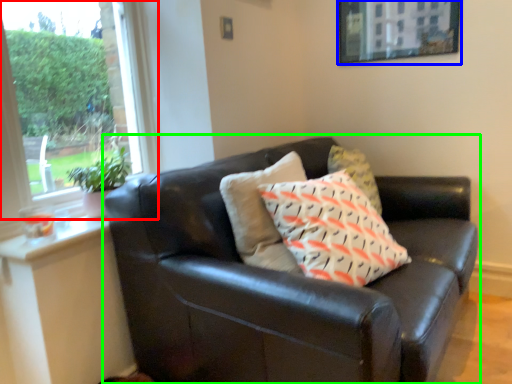
Question: Considering the real-world distances, which object is closest to window (highlighted by a red box)? picture frame (highlighted by a blue box) or studio couch (highlighted by a green box).

Choices:
 (A) picture frame
 (B) studio couch

Answer: (B)